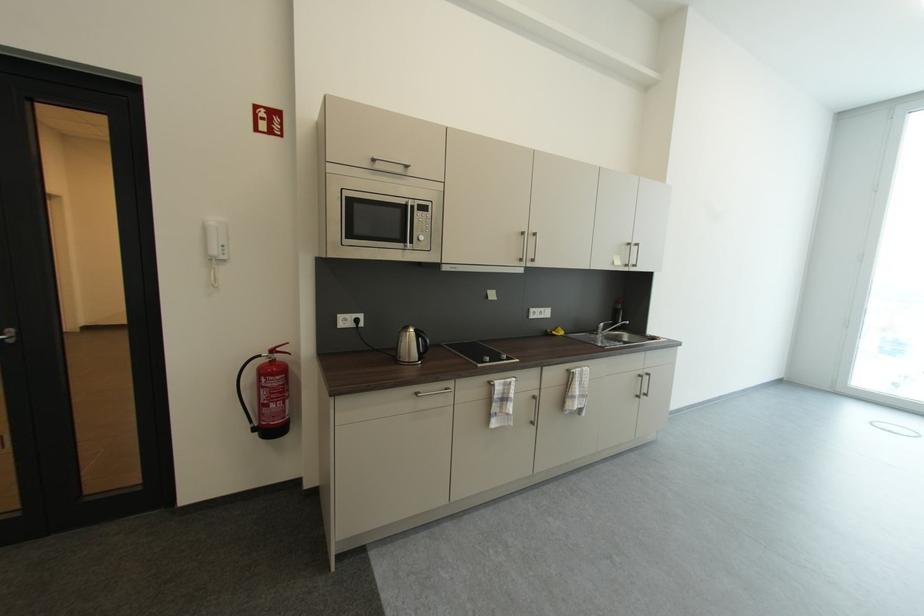
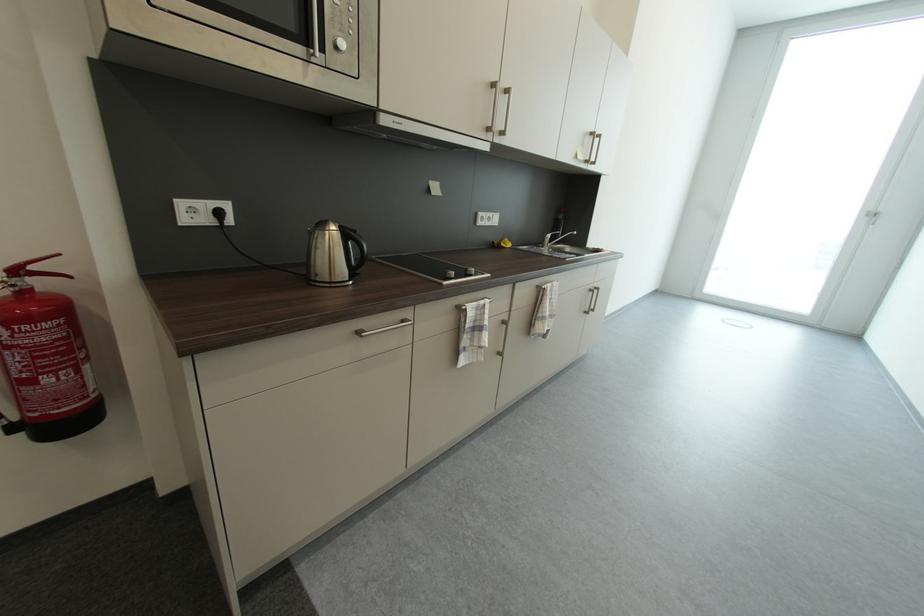
Locate, in the second image, the point that corresponds to (x=421, y=331) in the first image.

(346, 228)